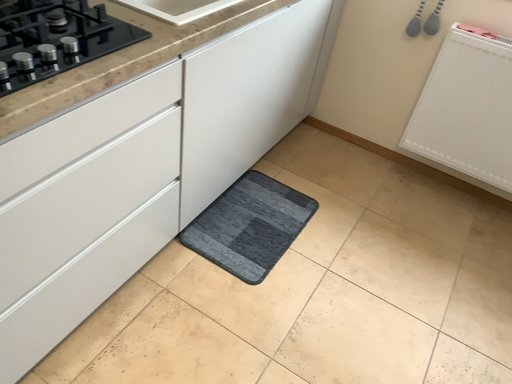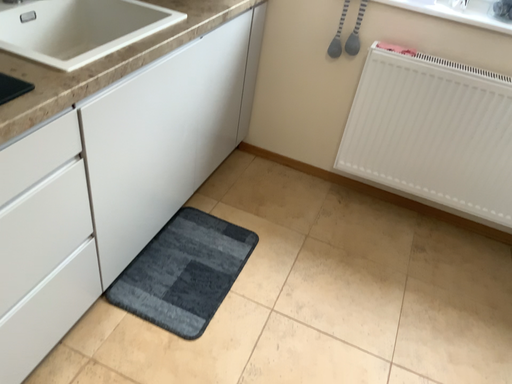
Question: How did the camera likely rotate when shooting the video?

Choices:
 (A) rotated right
 (B) rotated left

Answer: (A)